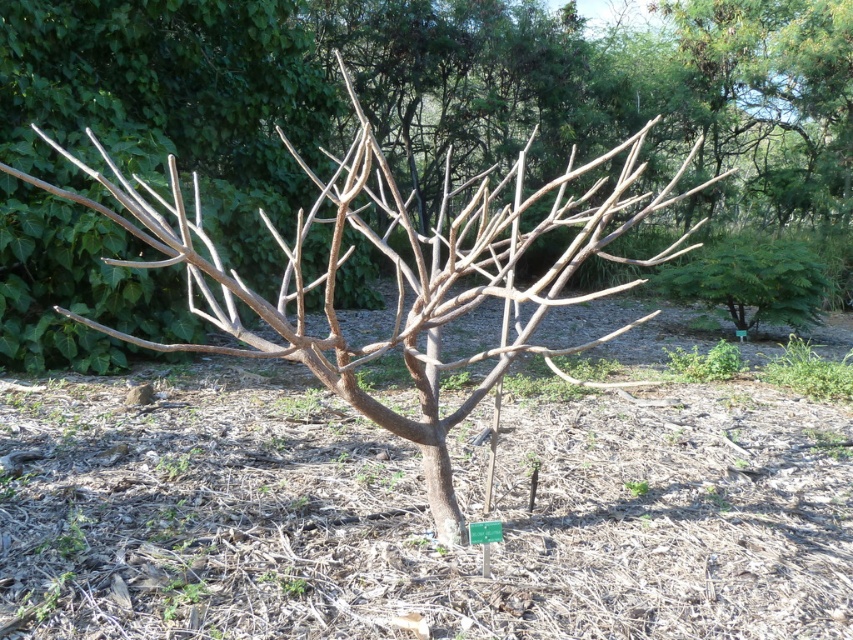
Question: From the image, what is the correct spatial relationship of green grass at lower right in relation to brown woody branch at center?

Choices:
 (A) right
 (B) left

Answer: (A)

Question: From the image, what is the correct spatial relationship of brown rough tree at center in relation to brown woody branch at center?

Choices:
 (A) below
 (B) above

Answer: (B)

Question: Is brown rough tree at center below green grass at lower right?

Choices:
 (A) yes
 (B) no

Answer: (B)

Question: Which of these objects is positioned closest to the green grass at lower right?

Choices:
 (A) brown dirt at center
 (B) green leafy plant at lower right

Answer: (B)

Question: Which point is farther to the camera?

Choices:
 (A) brown rough tree at center
 (B) brown woody branch at center
 (C) green grass at lower right
 (D) green leafy plant at lower right

Answer: (D)

Question: Among these points, which one is nearest to the camera?

Choices:
 (A) (236, 244)
 (B) (637, 484)

Answer: (B)